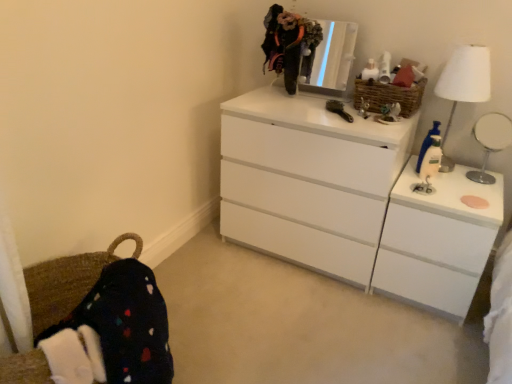
The height and width of the screenshot is (384, 512). Identify the location of free point below white fabric lampshade at right (from a real-world perspective). (450, 171).